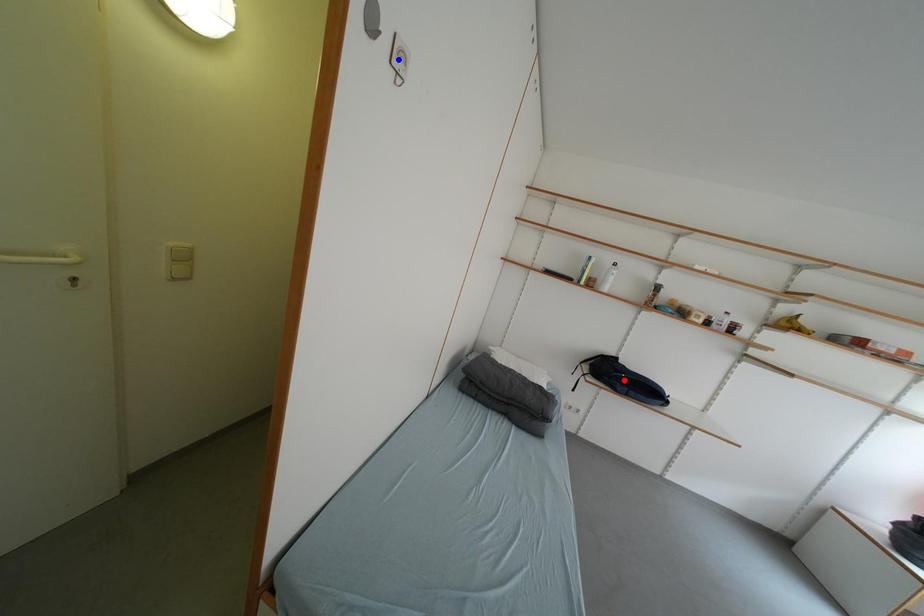
Question: Which of the two points in the image is closer to the camera?

Choices:
 (A) Blue point is closer.
 (B) Red point is closer.

Answer: (A)